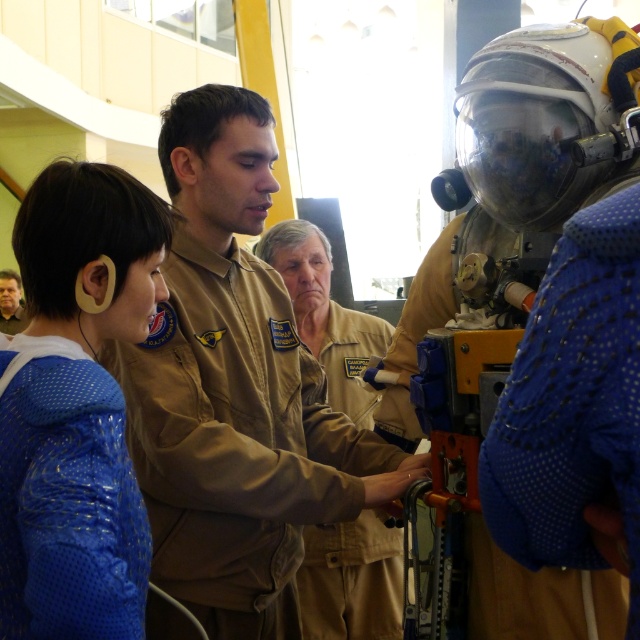
Question: Based on their relative distances, which object is nearer to the tan/khaki fabric uniform at center?

Choices:
 (A) blue mesh jacket at left
 (B) blue mesh uniform at center

Answer: (A)

Question: Does blue mesh uniform at center come behind blue mesh jacket at left?

Choices:
 (A) yes
 (B) no

Answer: (B)

Question: Is tan uniform at center smaller than brown leather jacket at lower left?

Choices:
 (A) no
 (B) yes

Answer: (B)

Question: Does blue mesh uniform at center appear under tan/khaki fabric uniform at center?

Choices:
 (A) yes
 (B) no

Answer: (B)

Question: Among these objects, which one is farthest from the camera?

Choices:
 (A) tan/khaki fabric uniform at center
 (B) tan uniform at center

Answer: (A)

Question: Which is farther from the blue mesh uniform at center?

Choices:
 (A) tan uniform at center
 (B) tan/khaki fabric uniform at center
 (C) brown leather jacket at lower left
 (D) blue mesh jacket at left

Answer: (C)